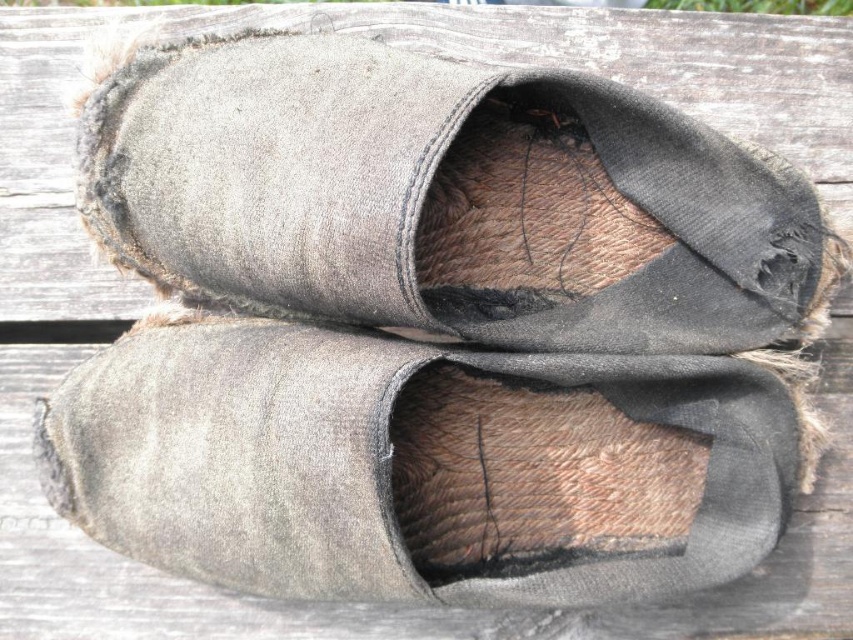
Between fuzzy suede slipper at center and gray suede shoe at center, which one appears on the right side from the viewer's perspective?

fuzzy suede slipper at center is more to the right.

Is point (155, 116) less distant than point (339, 592)?

No, it is not.

Where is `fuzzy suede slipper at center`? fuzzy suede slipper at center is located at coordinates (421, 195).